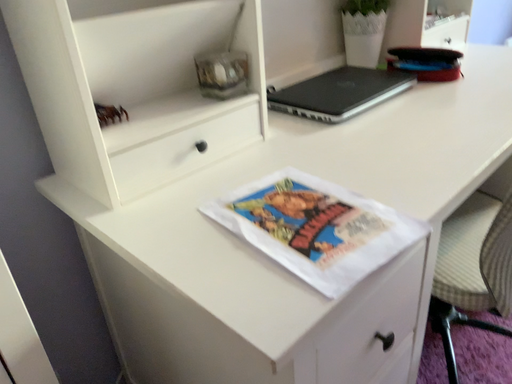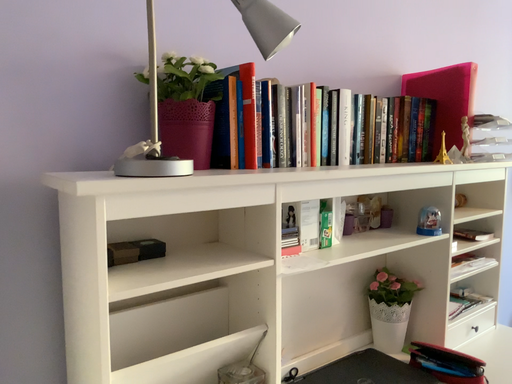
Question: How did the camera likely rotate when shooting the video?

Choices:
 (A) rotated downward
 (B) rotated upward

Answer: (B)